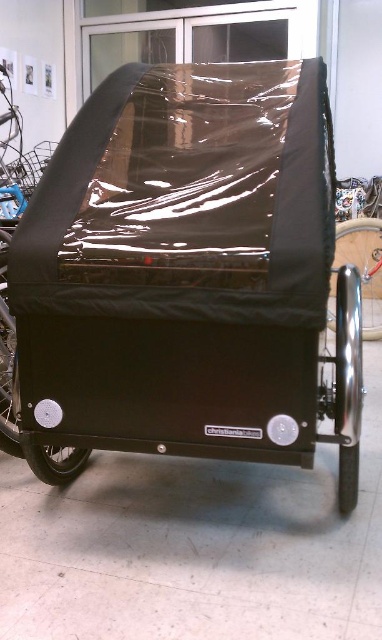
Question: Estimate the real-world distances between objects in this image. Which object is farther from the polished silver wheel at lower right?

Choices:
 (A) black metallic wheel at right
 (B) black matte baby carriage at center

Answer: (A)

Question: Considering the real-world distances, which object is closest to the black metallic wheel at right?

Choices:
 (A) polished silver wheel at lower right
 (B) black matte baby carriage at center

Answer: (A)

Question: Is polished silver wheel at lower right above black metallic wheel at right?

Choices:
 (A) yes
 (B) no

Answer: (B)

Question: Does black matte baby carriage at center have a smaller size compared to black metallic wheel at right?

Choices:
 (A) yes
 (B) no

Answer: (B)

Question: Which object is farther from the camera taking this photo?

Choices:
 (A) black metallic wheel at right
 (B) polished silver wheel at lower right

Answer: (A)

Question: Is polished silver wheel at lower right wider than black metallic wheel at right?

Choices:
 (A) no
 (B) yes

Answer: (A)